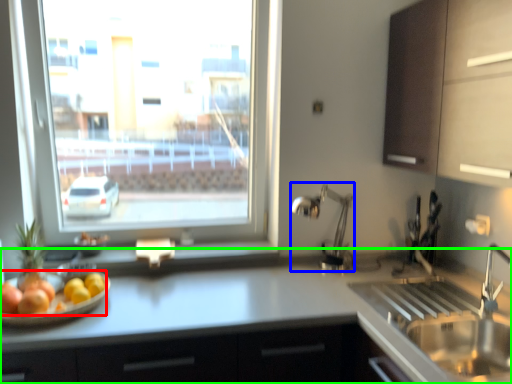
Question: Estimate the real-world distances between objects in this image. Which object is closer to fruit (highlighted by a red box), faucet (highlighted by a blue box) or countertop (highlighted by a green box)?

Choices:
 (A) faucet
 (B) countertop

Answer: (B)